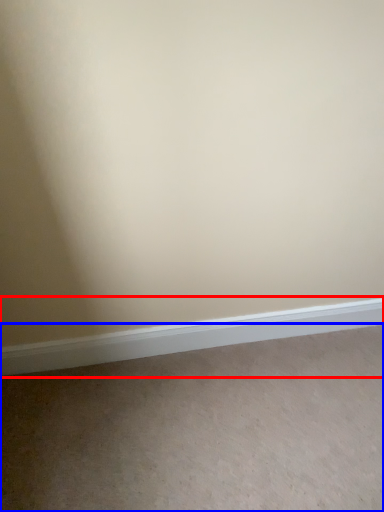
Question: Among these objects, which one is farthest to the camera, window sill (highlighted by a red box) or plain (highlighted by a blue box)?

Choices:
 (A) window sill
 (B) plain

Answer: (A)